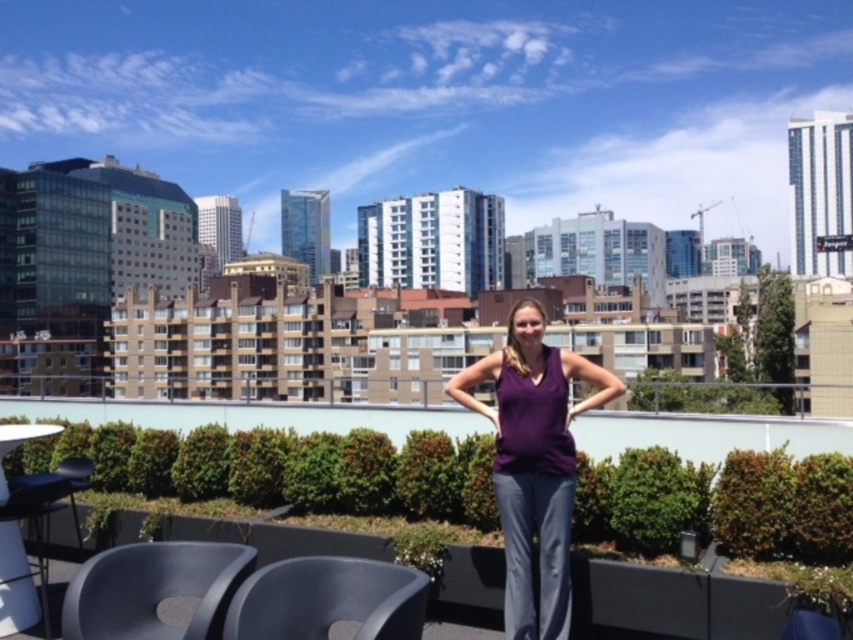
From the picture: You are a photographer setting up equipment on the rooftop. You have two chairs, the matte black chair at lower left and the black plastic chair at lower center. Which chair is closer to the edge of the rooftop where the person is posing?

The matte black chair at lower left is positioned on the left side of black plastic chair at lower center, so it is closer to the edge of the rooftop where the person is posing.

You are a photographer setting up for a photoshoot on the rooftop. You have a purple matte tank top at center and a black plastic chair at lower center in your frame. Which object is closer to the camera?

The purple matte tank top at center is closer to the camera because it is positioned over the black plastic chair at lower center, indicating it is in front of it.

You are a photographer trying to capture a photo of the purple matte tank top at center and the black plastic chair at lower center. Since you want both objects to be clearly visible in the frame, which object should you focus on first to ensure proper depth of field?

The purple matte tank top at center is taller than the black plastic chair at lower center, so you should focus on the purple matte tank top at center first to ensure both are in focus.